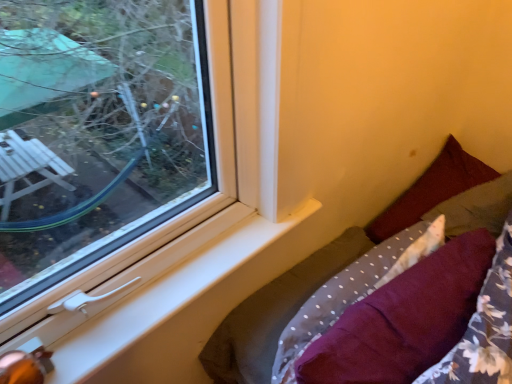
Question: Would you say maroon fabric pillow at right, the second pillow viewed from the right, is part of velvet burgundy pillow at lower right's contents?

Choices:
 (A) yes
 (B) no

Answer: (B)

Question: Is velvet burgundy pillow at lower right shorter than maroon fabric pillow at right, the second pillow viewed from the right?

Choices:
 (A) no
 (B) yes

Answer: (A)

Question: From a real-world perspective, does velvet burgundy pillow at lower right sit lower than maroon fabric pillow at right, the 2th pillow when ordered from left to right?

Choices:
 (A) yes
 (B) no

Answer: (A)

Question: Is velvet burgundy pillow at lower right outside maroon fabric pillow at right, the 2th pillow when ordered from left to right?

Choices:
 (A) no
 (B) yes

Answer: (B)

Question: Is velvet burgundy pillow at lower right bigger than maroon fabric pillow at right, the 2th pillow when ordered from left to right?

Choices:
 (A) no
 (B) yes

Answer: (B)

Question: Considering the positions of maroon fabric pillow at lower right, the third pillow viewed from the right, and maroon fabric pillow at right, which appears as the 3th pillow when viewed from the left, in the image, is maroon fabric pillow at lower right, the third pillow viewed from the right, taller or shorter than maroon fabric pillow at right, which appears as the 3th pillow when viewed from the left,?

Choices:
 (A) short
 (B) tall

Answer: (B)

Question: From the image's perspective, relative to maroon fabric pillow at right, arranged as the first pillow when viewed from the right, is maroon fabric pillow at lower right, the third pillow viewed from the right, above or below?

Choices:
 (A) below
 (B) above

Answer: (A)

Question: Is maroon fabric pillow at lower right, the third pillow viewed from the right, in front of or behind maroon fabric pillow at right, which appears as the 3th pillow when viewed from the left, in the image?

Choices:
 (A) behind
 (B) front

Answer: (B)

Question: Based on their sizes in the image, would you say maroon fabric pillow at lower right, the third pillow viewed from the right, is bigger or smaller than maroon fabric pillow at right, which appears as the 3th pillow when viewed from the left?

Choices:
 (A) big
 (B) small

Answer: (A)

Question: Is maroon fabric pillow at right, the second pillow viewed from the right, bigger or smaller than velvet burgundy pillow at lower right?

Choices:
 (A) big
 (B) small

Answer: (B)

Question: From a real-world perspective, is maroon fabric pillow at right, the 2th pillow when ordered from left to right, physically located above or below velvet burgundy pillow at lower right?

Choices:
 (A) below
 (B) above

Answer: (B)

Question: From their relative heights in the image, would you say maroon fabric pillow at right, the 2th pillow when ordered from left to right, is taller or shorter than velvet burgundy pillow at lower right?

Choices:
 (A) tall
 (B) short

Answer: (B)

Question: Is point (458, 188) closer or farther from the camera than point (274, 301)?

Choices:
 (A) closer
 (B) farther

Answer: (B)

Question: Which is correct: maroon fabric pillow at right, arranged as the first pillow when viewed from the right, is inside maroon fabric pillow at lower right, placed as the first pillow when sorted from left to right, or outside of it?

Choices:
 (A) outside
 (B) inside

Answer: (A)

Question: In terms of width, does maroon fabric pillow at right, arranged as the first pillow when viewed from the right, look wider or thinner when compared to maroon fabric pillow at lower right, the third pillow viewed from the right?

Choices:
 (A) thin
 (B) wide

Answer: (B)